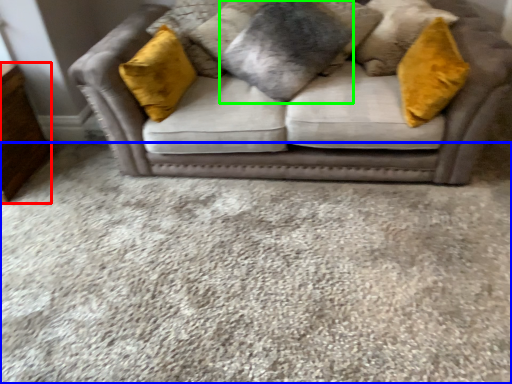
Question: Which object is the farthest from dresser (highlighted by a red box)? Choose among these: plain (highlighted by a blue box) or pillow (highlighted by a green box).

Choices:
 (A) plain
 (B) pillow

Answer: (B)